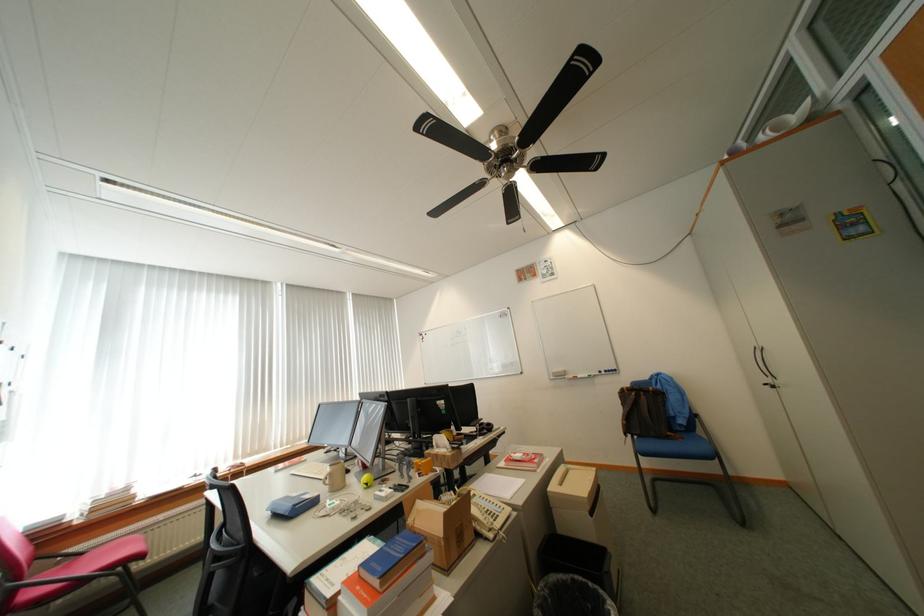
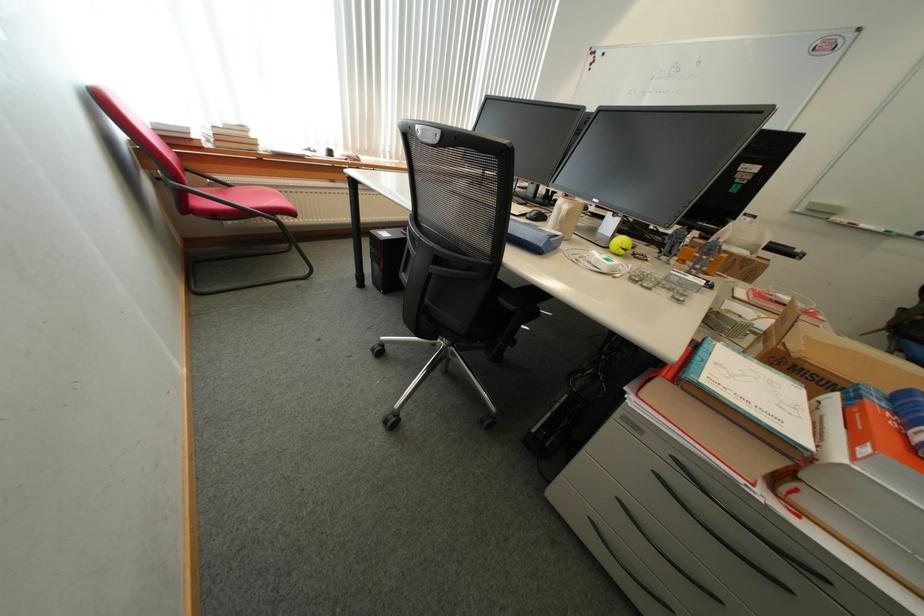
Find the pixel in the second image that matches point 561,376 in the first image.

(815, 207)